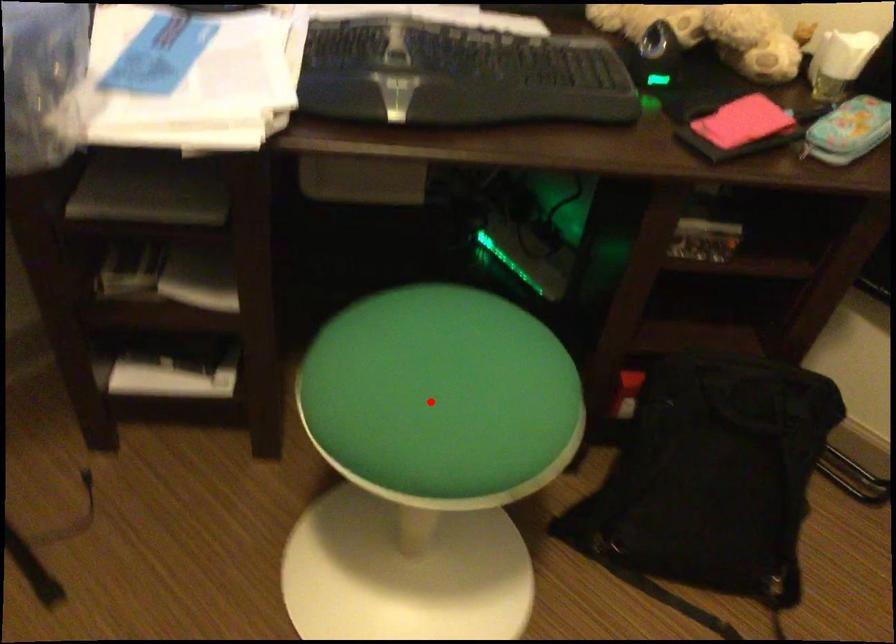
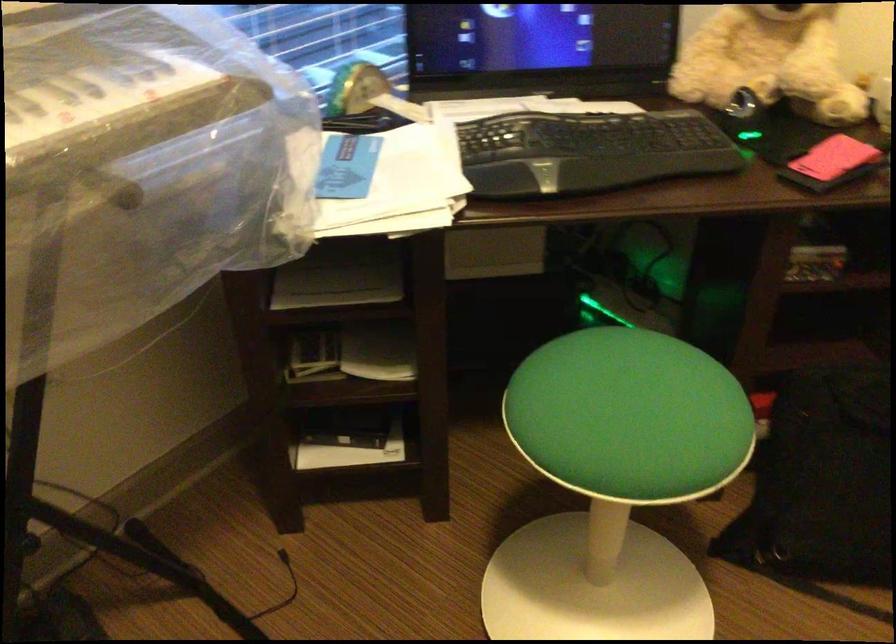
Question: A red point is marked in image1. In image2, is the corresponding 3D point closer to the camera or farther? Reply with the corresponding letter.

Choices:
 (A) The corresponding 3D point is closer.
 (B) The corresponding 3D point is farther.

Answer: (B)